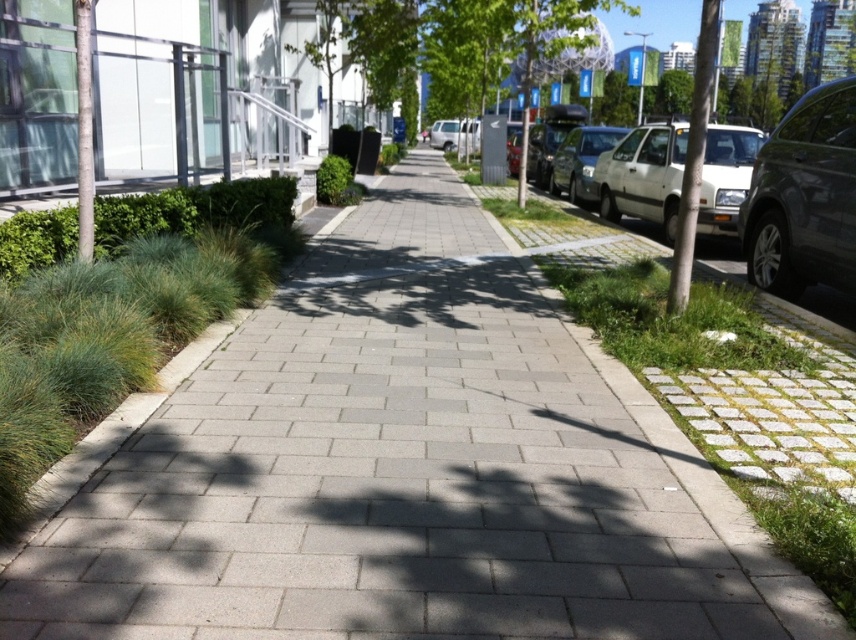
You are a delivery person trying to park your van between the shiny dark gray suv at right and the white matte car at right. Your van is 2.5 meters wide. Can you fit your van between them?

The shiny dark gray suv at right is wider than the white matte car at right, but the total width between them isn not provided. Without knowing the distance between the two cars, it is impossible to determine if the van will fit.

You are a delivery person standing on the sidewalk. You see a shiny dark gray suv at right and green grass at right. Which object is closer to the top edge of the image?

The shiny dark gray suv at right is located above green grass at right, so the shiny dark gray suv at right is closer to the top edge of the image.

You are standing on the sidewalk in the urban scene. There are two points marked on the walkway. The first point is at coordinates point (803,188) and the second is at point (669,225). Which point is closer to you?

Point (803,188) is closer to the viewer than point (669,225).